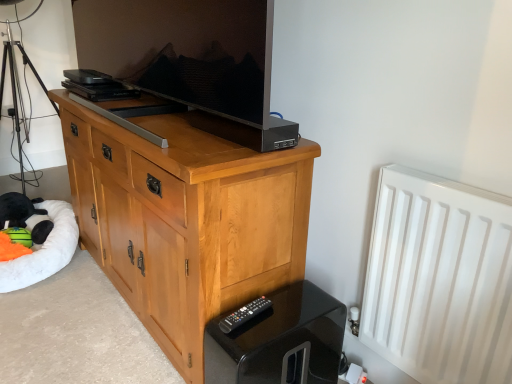
Question: Does white matte radiator at right appear on the left side of black glossy remote control at lower right?

Choices:
 (A) no
 (B) yes

Answer: (A)

Question: Can you confirm if white matte radiator at right is wider than black glossy remote control at lower right?

Choices:
 (A) yes
 (B) no

Answer: (B)

Question: From a real-world perspective, is white matte radiator at right positioned over black glossy remote control at lower right based on gravity?

Choices:
 (A) no
 (B) yes

Answer: (B)

Question: Is white matte radiator at right outside of black glossy remote control at lower right?

Choices:
 (A) yes
 (B) no

Answer: (A)

Question: From a real-world perspective, is white matte radiator at right beneath black glossy remote control at lower right?

Choices:
 (A) yes
 (B) no

Answer: (B)

Question: Are white matte radiator at right and black glossy remote control at lower right beside each other?

Choices:
 (A) no
 (B) yes

Answer: (A)

Question: Considering the relative sizes of matte black television at center and white matte radiator at right in the image provided, is matte black television at center bigger than white matte radiator at right?

Choices:
 (A) no
 (B) yes

Answer: (B)

Question: From a real-world perspective, is matte black television at center located beneath white matte radiator at right?

Choices:
 (A) yes
 (B) no

Answer: (B)

Question: Are matte black television at center and white matte radiator at right making contact?

Choices:
 (A) no
 (B) yes

Answer: (A)

Question: Does matte black television at center lie in front of white matte radiator at right?

Choices:
 (A) yes
 (B) no

Answer: (A)

Question: Is matte black television at center thinner than white matte radiator at right?

Choices:
 (A) yes
 (B) no

Answer: (B)

Question: Is matte black television at center shorter than white matte radiator at right?

Choices:
 (A) no
 (B) yes

Answer: (B)

Question: Would you say black plastic remote at lower center is outside black metal tripod at left?

Choices:
 (A) yes
 (B) no

Answer: (A)